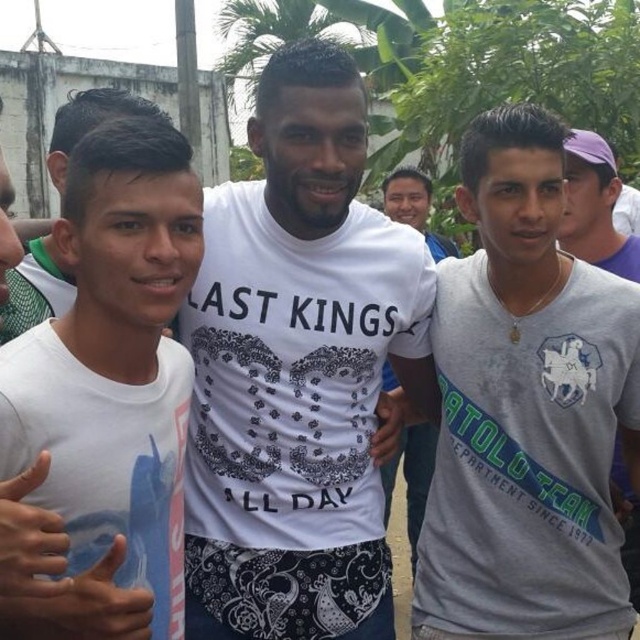
Can you confirm if white matte t-shirt at center is positioned above white printed t-shirt at center?

No, white matte t-shirt at center is not above white printed t-shirt at center.

Who is lower down, white matte t-shirt at center or white printed t-shirt at center?

Positioned lower is white matte t-shirt at center.

In order to click on white matte t-shirt at center in this screenshot , I will do `click(120, 344)`.

Is point (556, 465) farther from camera compared to point (179, 260)?

Yes, point (556, 465) is farther from viewer.

Is gray matte shirt at center taller than white matte t-shirt at center?

Yes.

Does point (548, 467) come closer to viewer compared to point (189, 224)?

No, it is not.

You are a GUI agent. You are given a task and a screenshot of the screen. Output one action in this format:
    pyautogui.click(x=<x>, y=<y>)
    Task: Click on the gray matte shirt at center
    This screenshot has height=640, width=640.
    Given the screenshot: What is the action you would take?
    pyautogui.click(x=525, y=410)

Which is more to the left, gray matte shirt at center or white printed t-shirt at center?

Positioned to the left is white printed t-shirt at center.

What are the coordinates of `gray matte shirt at center` in the screenshot? It's located at (525, 410).